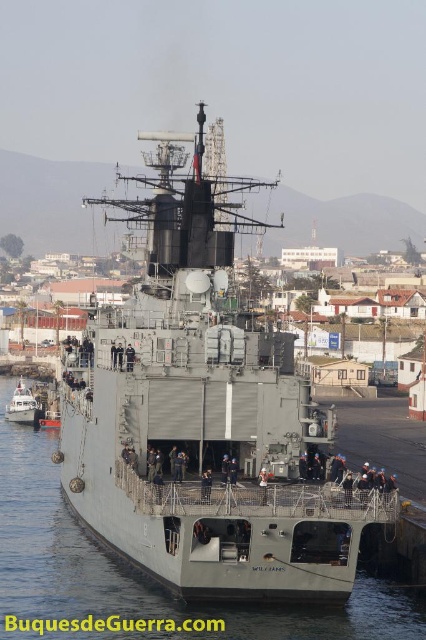
You are standing on the dock next to the WILLIAMS naval ship. There is a specific point marked at coordinates point (150, 596). If you want to throw a lifebuoy to someone near that point, and the lifebuoy can travel up to 70 meters, will you be able to reach them?

The distance between you and the point (150, 596) is 69.58 meters, which is within the lifebuoy range. Yes, you can reach them.

You are a sailor on the WILLIAMS naval ship. You need to determine if the gray metallic water at lower center is higher than the white matte boat at lower left. Based on the scene, what can you conclude?

The gray metallic water at lower center has a greater height compared to the white matte boat at lower left, so the gray metallic water at lower center is higher than the white matte boat at lower left.

Looking at this image, you are a harbor pilot guiding a tugboat that needs to maneuver between the gray matte ship at center and the white matte boat at lower left. The tugboat requires a minimum of 50 meters of space to safely pass. Based on the scene, can the tugboat safely navigate through this gap?

The gray matte ship at center is 51.36 meters away from the white matte boat at lower left. Since the required minimum space for the tugboat is 50 meters, the distance is sufficient, so the tugboat can safely navigate through the gap between them.